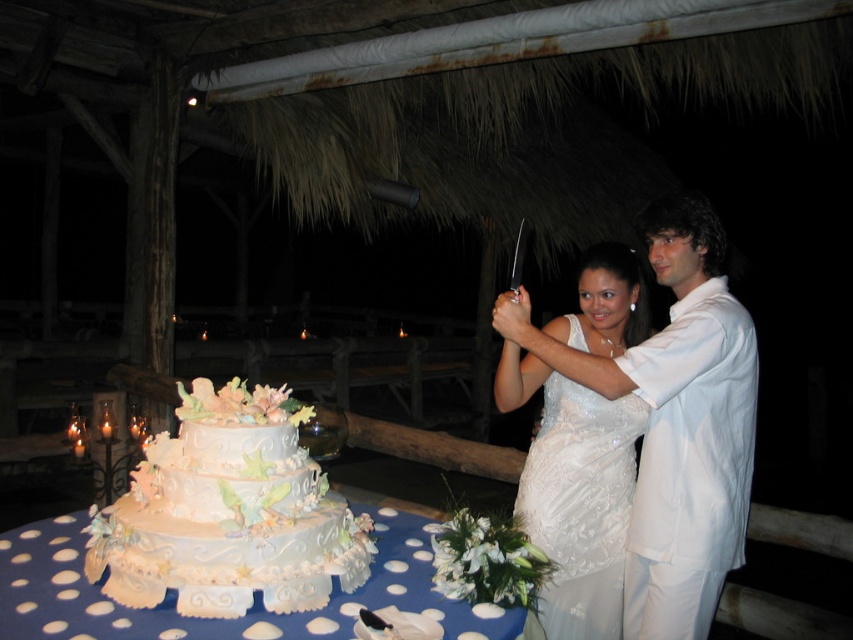
Between white satin suit at right and white polka dot fabric at lower center, which one is positioned lower?

white polka dot fabric at lower center

Image resolution: width=853 pixels, height=640 pixels. I want to click on white satin suit at right, so click(x=689, y=429).

The width and height of the screenshot is (853, 640). I want to click on white satin suit at right, so click(x=689, y=429).

In order to click on white satin suit at right in this screenshot , I will do `click(689, 429)`.

Is white satin suit at right closer to the viewer compared to white satin dress at center?

Yes.

Between white satin suit at right and white satin dress at center, which one appears on the left side from the viewer's perspective?

white satin dress at center

Is point (643, 467) more distant than point (595, 486)?

No, (643, 467) is in front of (595, 486).

You are a GUI agent. You are given a task and a screenshot of the screen. Output one action in this format:
    pyautogui.click(x=<x>, y=<y>)
    Task: Click on the white satin suit at right
    This screenshot has height=640, width=853.
    Given the screenshot: What is the action you would take?
    pyautogui.click(x=689, y=429)

Can you confirm if white satin dress at center is taller than white polka dot fabric at lower center?

Indeed, white satin dress at center has a greater height compared to white polka dot fabric at lower center.

The height and width of the screenshot is (640, 853). What do you see at coordinates (573, 492) in the screenshot?
I see `white satin dress at center` at bounding box center [573, 492].

Locate an element on the screen. The width and height of the screenshot is (853, 640). white satin dress at center is located at coordinates (573, 492).